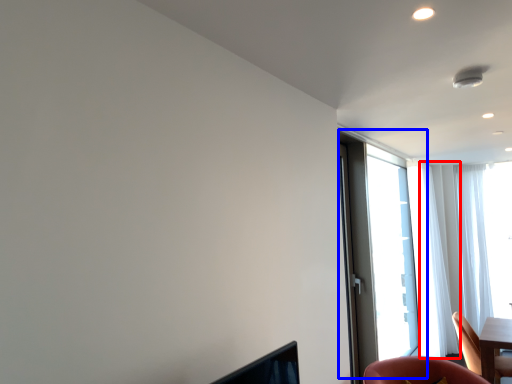
Question: Among these objects, which one is nearest to the camera, curtain (highlighted by a red box) or window (highlighted by a blue box)?

Choices:
 (A) curtain
 (B) window

Answer: (B)